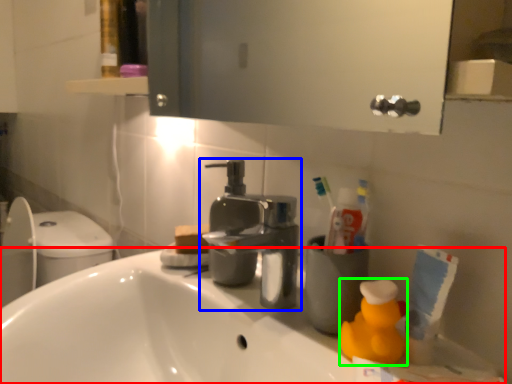
Question: Considering the real-world distances, which object is farthest from counter top (highlighted by a red box)? tap (highlighted by a blue box) or cleaning product (highlighted by a green box)?

Choices:
 (A) tap
 (B) cleaning product

Answer: (B)